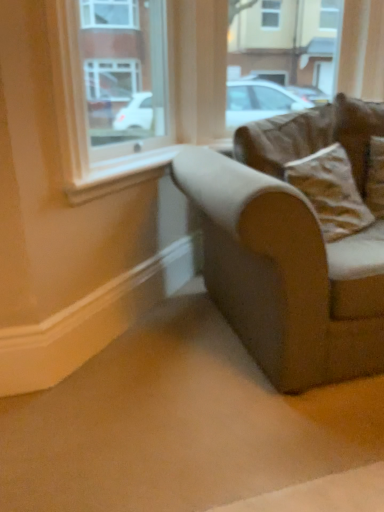
What is the approximate height of brown fabric pillow at right, which appears as the second pillow when viewed from the top?

19.35 inches.

In order to face brown suede pillow at upper right, marked as the second pillow in a bottom-to-top arrangement, should I rotate leftwards or rightwards?

Turn right by 21.183 degrees to look at brown suede pillow at upper right, marked as the second pillow in a bottom-to-top arrangement.

I want to click on clear glass window at upper left, so click(113, 90).

Locate an element on the screen. This screenshot has height=512, width=384. brown fabric couch at right is located at coordinates [294, 245].

Is brown fabric couch at right aimed at brown suede pillow at upper right, which is counted as the 1th pillow, starting from the top?

No, brown fabric couch at right is not facing towards brown suede pillow at upper right, which is counted as the 1th pillow, starting from the top.

In terms of size, does brown fabric couch at right appear bigger or smaller than brown suede pillow at upper right, which is counted as the 1th pillow, starting from the top?

Considering their sizes, brown fabric couch at right takes up more space than brown suede pillow at upper right, which is counted as the 1th pillow, starting from the top.

Is brown fabric couch at right to the right of brown suede pillow at upper right, marked as the second pillow in a bottom-to-top arrangement, from the viewer's perspective?

No.

Considering the points (383, 112) and (167, 79), which point is in front, point (383, 112) or point (167, 79)?

Positioned in front is point (383, 112).

Is brown suede pillow at upper right, which is counted as the 1th pillow, starting from the top, smaller than clear glass window at upper left?

Yes, brown suede pillow at upper right, which is counted as the 1th pillow, starting from the top, is smaller than clear glass window at upper left.

From a real-world perspective, is brown suede pillow at upper right, marked as the second pillow in a bottom-to-top arrangement, physically located above or below clear glass window at upper left?

In terms of real-world spatial position, brown suede pillow at upper right, marked as the second pillow in a bottom-to-top arrangement, is below clear glass window at upper left.

Does point (378, 334) come in front of point (342, 157)?

Yes, point (378, 334) is closer to viewer.

From the picture: From a real-world perspective, which is physically below, brown fabric couch at right or brown fabric pillow at right, which is the 1th pillow in bottom-to-top order?

brown fabric couch at right is physically lower.

Is brown fabric pillow at right, which appears as the second pillow when viewed from the top, at the back of brown fabric couch at right?

Yes, brown fabric couch at right is facing away from brown fabric pillow at right, which appears as the second pillow when viewed from the top.

Measure the distance between brown suede pillow at upper right, which is counted as the 1th pillow, starting from the top, and brown fabric pillow at right, which appears as the second pillow when viewed from the top.

11.68 inches.

Is brown fabric pillow at right, which is the 1th pillow in bottom-to-top order, at the back of brown suede pillow at upper right, marked as the second pillow in a bottom-to-top arrangement?

No, brown suede pillow at upper right, marked as the second pillow in a bottom-to-top arrangement, is not facing the opposite direction of brown fabric pillow at right, which is the 1th pillow in bottom-to-top order.

Where is `pillow above the brown fabric pillow at right, which appears as the second pillow when viewed from the top (from a real-world perspective)`? The image size is (384, 512). pillow above the brown fabric pillow at right, which appears as the second pillow when viewed from the top (from a real-world perspective) is located at coordinates (357, 132).

Which is behind, point (335, 131) or point (359, 225)?

The point (335, 131) is behind.

From the image's perspective, between brown suede pillow at upper right, marked as the second pillow in a bottom-to-top arrangement, and brown fabric couch at right, who is located below?

brown fabric couch at right, from the image's perspective.

From a real-world perspective, is brown suede pillow at upper right, which is counted as the 1th pillow, starting from the top, positioned over brown fabric couch at right based on gravity?

Yes, from a real-world perspective, brown suede pillow at upper right, which is counted as the 1th pillow, starting from the top, is on top of brown fabric couch at right.

Is brown suede pillow at upper right, marked as the second pillow in a bottom-to-top arrangement, looking in the opposite direction of brown fabric couch at right?

Correct, brown suede pillow at upper right, marked as the second pillow in a bottom-to-top arrangement, is looking away from brown fabric couch at right.

Is brown suede pillow at upper right, which is counted as the 1th pillow, starting from the top, in front of or behind brown fabric couch at right in the image?

brown suede pillow at upper right, which is counted as the 1th pillow, starting from the top, is positioned farther from the viewer than brown fabric couch at right.

Is point (99, 129) in front of point (333, 173)?

No, it is behind (333, 173).

Is clear glass window at upper left positioned beyond the bounds of brown fabric pillow at right, which is the 1th pillow in bottom-to-top order?

Absolutely, clear glass window at upper left is external to brown fabric pillow at right, which is the 1th pillow in bottom-to-top order.

Which of these two, clear glass window at upper left or brown fabric pillow at right, which appears as the second pillow when viewed from the top, stands shorter?

brown fabric pillow at right, which appears as the second pillow when viewed from the top, is shorter.

Which is closer, (x=285, y=170) or (x=118, y=92)?

Point (x=285, y=170) is closer to the camera than point (x=118, y=92).

Is brown fabric pillow at right, which appears as the second pillow when viewed from the top, in contact with clear glass window at upper left?

No.

In order to click on studio couch below the brown suede pillow at upper right, which is counted as the 1th pillow, starting from the top (from a real-world perspective) in this screenshot , I will do (x=294, y=245).

Image resolution: width=384 pixels, height=512 pixels. In order to click on window that appears above the brown suede pillow at upper right, marked as the second pillow in a bottom-to-top arrangement (from a real-world perspective) in this screenshot , I will do `click(113, 90)`.

Looking at the image, which one is located further to brown suede pillow at upper right, which is counted as the 1th pillow, starting from the top, brown fabric couch at right or clear glass window at upper left?

Based on the image, clear glass window at upper left appears to be further to brown suede pillow at upper right, which is counted as the 1th pillow, starting from the top.

Considering their positions, is brown fabric couch at right positioned closer to brown suede pillow at upper right, which is counted as the 1th pillow, starting from the top, than brown fabric pillow at right, which appears as the second pillow when viewed from the top?

brown fabric pillow at right, which appears as the second pillow when viewed from the top.

Consider the image. Which object lies nearer to the anchor point brown fabric couch at right, brown fabric pillow at right, which is the 1th pillow in bottom-to-top order, or brown suede pillow at upper right, which is counted as the 1th pillow, starting from the top?

brown fabric pillow at right, which is the 1th pillow in bottom-to-top order, is closer to brown fabric couch at right.

Estimate the real-world distances between objects in this image. Which object is closer to brown fabric couch at right, brown suede pillow at upper right, which is counted as the 1th pillow, starting from the top, or clear glass window at upper left?

Based on the image, brown suede pillow at upper right, which is counted as the 1th pillow, starting from the top, appears to be nearer to brown fabric couch at right.

Considering their positions, is clear glass window at upper left positioned closer to brown fabric couch at right than brown fabric pillow at right, which appears as the second pillow when viewed from the top?

brown fabric pillow at right, which appears as the second pillow when viewed from the top, lies closer to brown fabric couch at right than the other object.

Looking at the image, which one is located closer to clear glass window at upper left, brown fabric couch at right or brown suede pillow at upper right, marked as the second pillow in a bottom-to-top arrangement?

brown suede pillow at upper right, marked as the second pillow in a bottom-to-top arrangement, is closer to clear glass window at upper left.

Looking at this image, based on their spatial positions, is clear glass window at upper left or brown suede pillow at upper right, marked as the second pillow in a bottom-to-top arrangement, further from brown fabric pillow at right, which is the 1th pillow in bottom-to-top order?

Based on the image, clear glass window at upper left appears to be further to brown fabric pillow at right, which is the 1th pillow in bottom-to-top order.

Based on their spatial positions, is clear glass window at upper left or brown suede pillow at upper right, marked as the second pillow in a bottom-to-top arrangement, closer to brown fabric couch at right?

Among the two, brown suede pillow at upper right, marked as the second pillow in a bottom-to-top arrangement, is located nearer to brown fabric couch at right.

I want to click on pillow between clear glass window at upper left and brown suede pillow at upper right, marked as the second pillow in a bottom-to-top arrangement, in the horizontal direction, so click(x=331, y=191).

Locate an element on the screen. This screenshot has width=384, height=512. pillow between brown fabric couch at right and brown suede pillow at upper right, which is counted as the 1th pillow, starting from the top, in the front-back direction is located at coordinates click(331, 191).

Locate an element on the screen. studio couch between clear glass window at upper left and brown suede pillow at upper right, which is counted as the 1th pillow, starting from the top, in the horizontal direction is located at coordinates click(294, 245).

Identify the location of pillow between clear glass window at upper left and brown fabric couch at right. (331, 191).